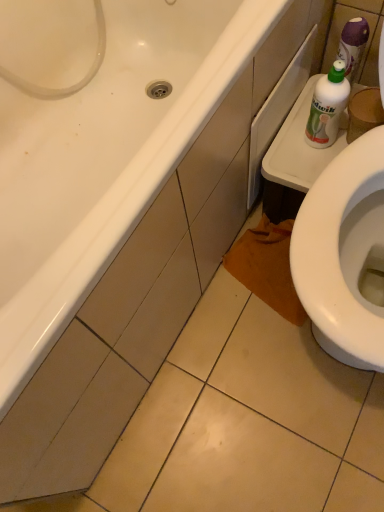
Question: Is white glossy bathtub at upper left taller or shorter than green plastic bottle at upper right?

Choices:
 (A) tall
 (B) short

Answer: (A)

Question: From the image's perspective, relative to green plastic bottle at upper right, is white glossy bathtub at upper left above or below?

Choices:
 (A) below
 (B) above

Answer: (A)

Question: Considering the positions of white glossy bathtub at upper left and green plastic bottle at upper right in the image, is white glossy bathtub at upper left wider or thinner than green plastic bottle at upper right?

Choices:
 (A) wide
 (B) thin

Answer: (A)

Question: Is green plastic bottle at upper right to the left or to the right of white glossy bathtub at upper left in the image?

Choices:
 (A) right
 (B) left

Answer: (A)

Question: From the image's perspective, is green plastic bottle at upper right positioned above or below white glossy bathtub at upper left?

Choices:
 (A) above
 (B) below

Answer: (A)

Question: Is green plastic bottle at upper right wider or thinner than white glossy bathtub at upper left?

Choices:
 (A) wide
 (B) thin

Answer: (B)

Question: Is green plastic bottle at upper right inside the boundaries of white glossy bathtub at upper left, or outside?

Choices:
 (A) inside
 (B) outside

Answer: (B)